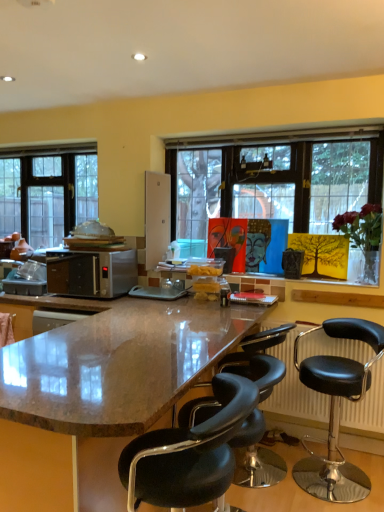
Question: Is black leather radiator at lower right taller or shorter than shiny granite countertop at center?

Choices:
 (A) tall
 (B) short

Answer: (B)

Question: Choose the correct answer: Is black leather radiator at lower right inside shiny granite countertop at center or outside it?

Choices:
 (A) outside
 (B) inside

Answer: (A)

Question: Which is farther from the black leather stool at center, which is counted as the third chair, starting from the back?

Choices:
 (A) black leather stool at lower right, the 2th chair from the front
 (B) black leather bar stool at center, arranged as the 3th chair when viewed from the front
 (C) shiny granite countertop at center
 (D) clear glass window at left
 (E) black leather radiator at lower right

Answer: (D)

Question: Estimate the real-world distances between objects in this image. Which object is closer to the satin silver microwave at center?

Choices:
 (A) black leather stool at lower right, arranged as the second chair when viewed from the back
 (B) black leather radiator at lower right
 (C) black leather bar stool at center, arranged as the 3th chair when viewed from the front
 (D) black leather stool at center, which is counted as the third chair, starting from the back
 (E) clear glass window at left

Answer: (E)